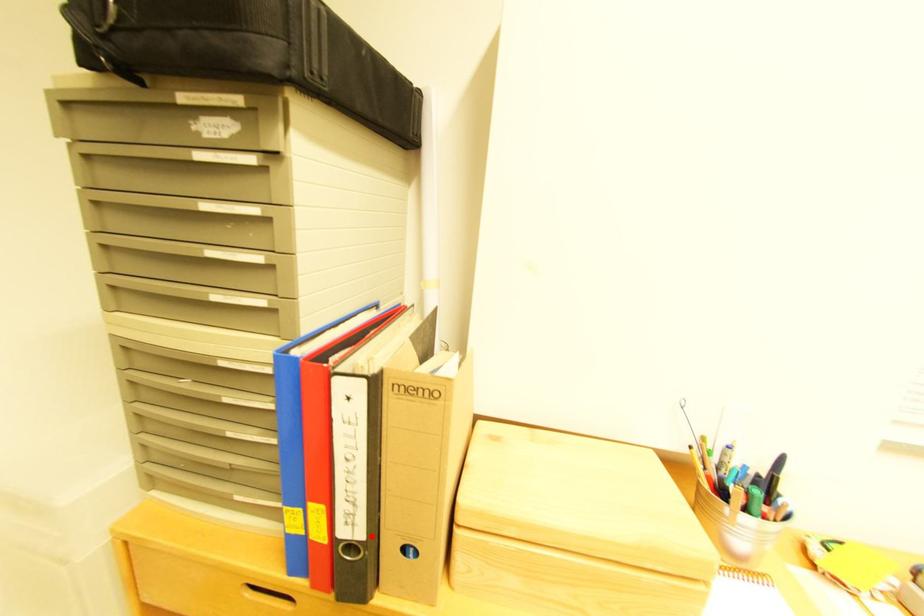
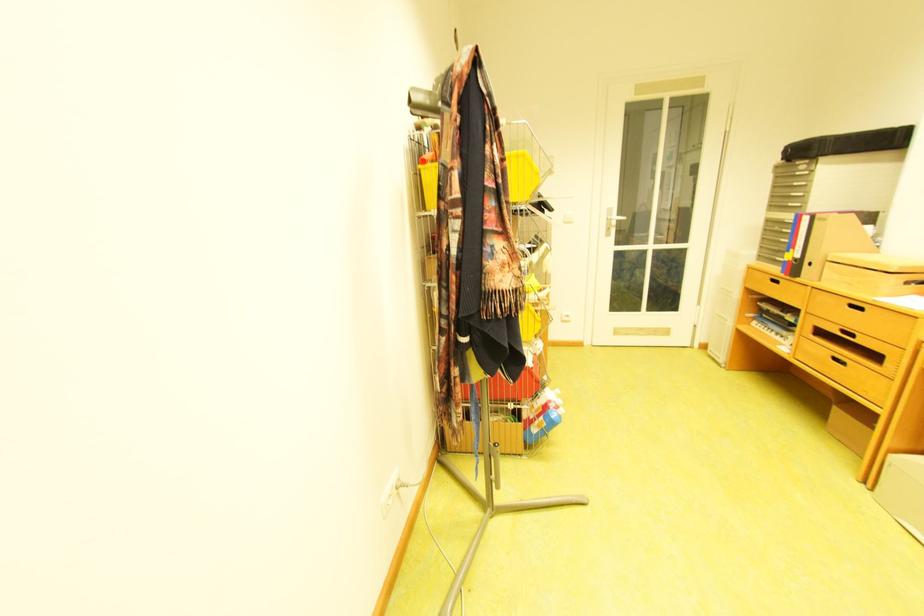
Find the pixel in the second image that matches the highlighted location in the first image.

(809, 257)